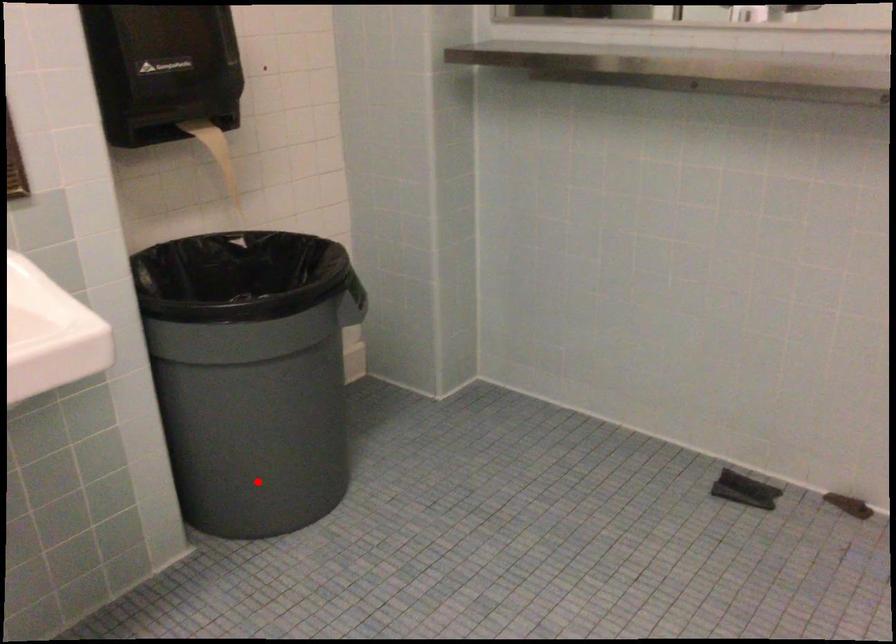
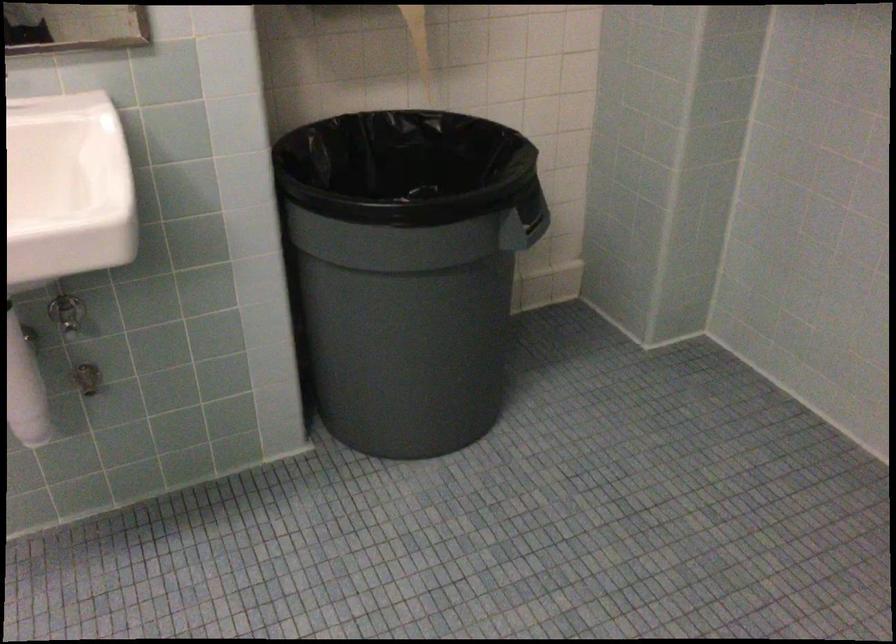
Question: A red point is marked in image1. In image2, is the corresponding 3D point closer to the camera or farther? Reply with the corresponding letter.

Choices:
 (A) The corresponding 3D point is closer.
 (B) The corresponding 3D point is farther.

Answer: (A)